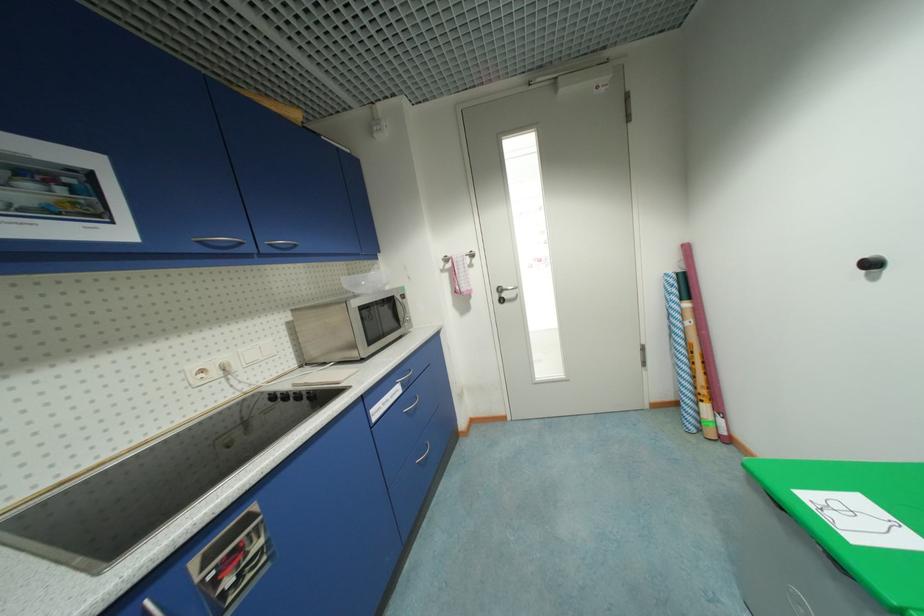
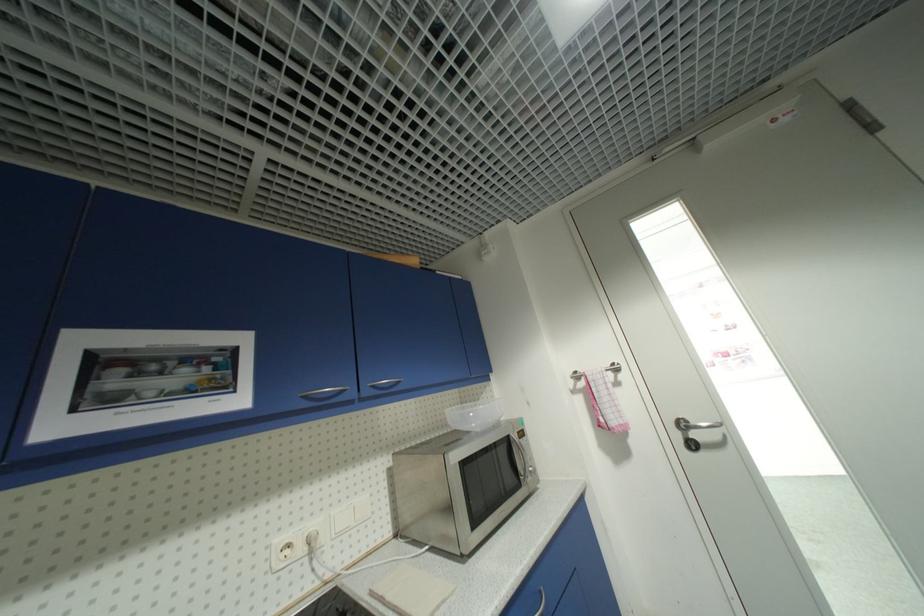
Consider the image. How did the camera likely rotate?

The rotation direction of the camera is left-up.